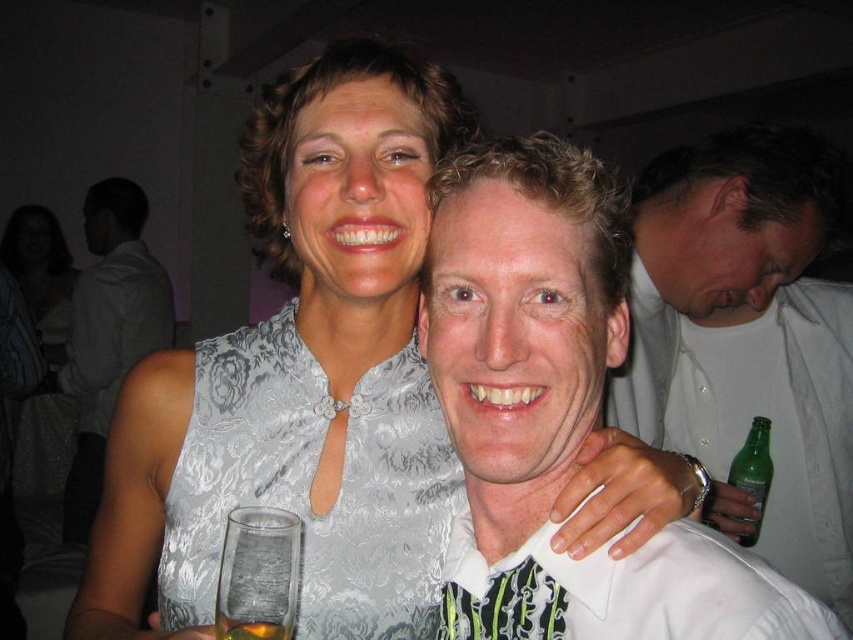
Question: Does matte white dress at upper center appear on the left side of clear glass at lower center?

Choices:
 (A) yes
 (B) no

Answer: (A)

Question: Is clear glass at lower center above clear glass at center?

Choices:
 (A) yes
 (B) no

Answer: (B)

Question: Which of the following is the closest to the observer?

Choices:
 (A) (804, 496)
 (B) (171, 522)
 (C) (730, 476)

Answer: (B)

Question: Which is farther from the clear glass at center?

Choices:
 (A) matte white dress at upper center
 (B) green glass bottle at right

Answer: (A)

Question: Is matte white dress at upper center below clear glass at lower center?

Choices:
 (A) no
 (B) yes

Answer: (A)

Question: Which of the following is the farthest from the observer?

Choices:
 (A) (219, 621)
 (B) (743, 449)

Answer: (B)